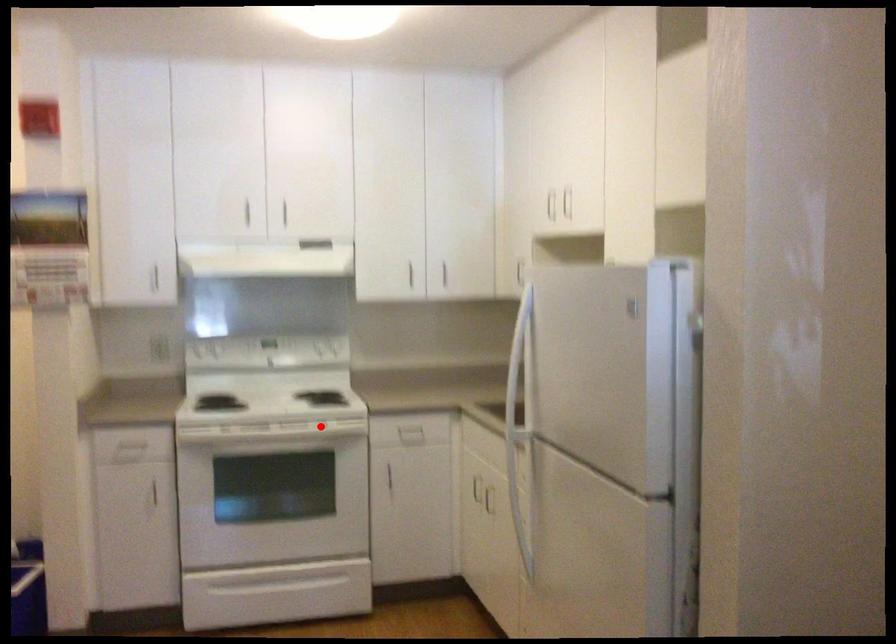
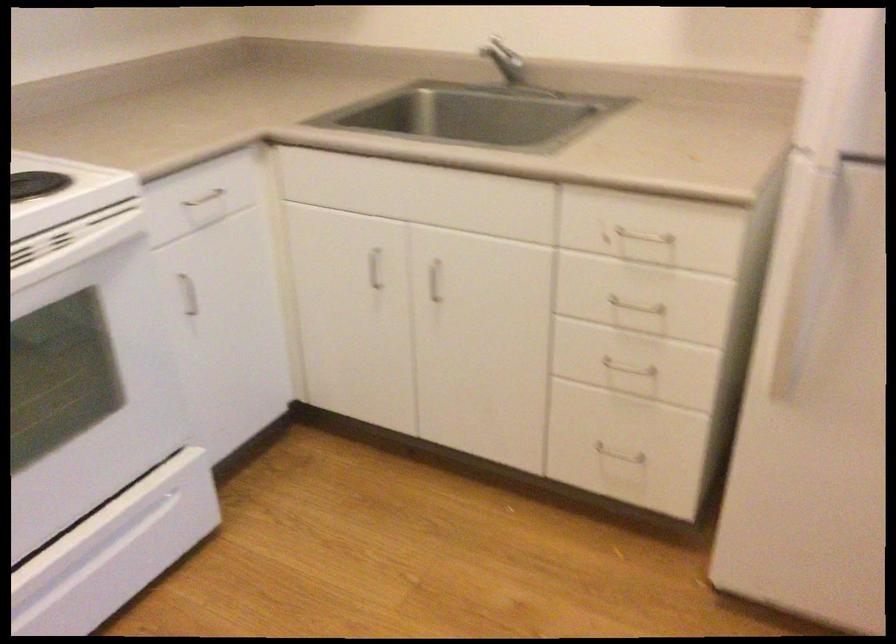
In the second image, find the point that corresponds to the highlighted location in the first image.

(73, 243)